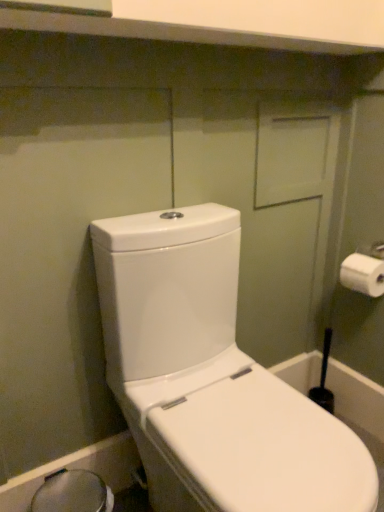
Question: Is white matte toilet paper at right turned away from transparent plastic bidet at lower left?

Choices:
 (A) no
 (B) yes

Answer: (A)

Question: Considering the relative positions of white matte toilet paper at right and transparent plastic bidet at lower left in the image provided, is white matte toilet paper at right in front of transparent plastic bidet at lower left?

Choices:
 (A) yes
 (B) no

Answer: (B)

Question: Are white matte toilet paper at right and transparent plastic bidet at lower left far apart?

Choices:
 (A) no
 (B) yes

Answer: (B)

Question: Does white matte toilet paper at right have a smaller size compared to transparent plastic bidet at lower left?

Choices:
 (A) yes
 (B) no

Answer: (A)

Question: From a real-world perspective, is white matte toilet paper at right beneath transparent plastic bidet at lower left?

Choices:
 (A) yes
 (B) no

Answer: (B)

Question: Based on their sizes in the image, would you say white matte toilet paper at right is bigger or smaller than white glossy toilet at left?

Choices:
 (A) big
 (B) small

Answer: (B)

Question: Would you say white matte toilet paper at right is to the left or to the right of white glossy toilet at left in the picture?

Choices:
 (A) right
 (B) left

Answer: (A)

Question: In terms of width, does white matte toilet paper at right look wider or thinner when compared to white glossy toilet at left?

Choices:
 (A) thin
 (B) wide

Answer: (A)

Question: From a real-world perspective, is white matte toilet paper at right above or below white glossy toilet at left?

Choices:
 (A) above
 (B) below

Answer: (A)

Question: Relative to transparent plastic bidet at lower left, is white matte toilet paper at right in front or behind?

Choices:
 (A) behind
 (B) front

Answer: (A)

Question: Visually, is white matte toilet paper at right positioned to the left or to the right of transparent plastic bidet at lower left?

Choices:
 (A) left
 (B) right

Answer: (B)

Question: In terms of width, does white matte toilet paper at right look wider or thinner when compared to transparent plastic bidet at lower left?

Choices:
 (A) thin
 (B) wide

Answer: (A)

Question: Is point (367, 264) closer or farther from the camera than point (41, 494)?

Choices:
 (A) farther
 (B) closer

Answer: (A)

Question: Based on their sizes in the image, would you say transparent plastic bidet at lower left is bigger or smaller than white glossy toilet at left?

Choices:
 (A) small
 (B) big

Answer: (A)

Question: Is transparent plastic bidet at lower left taller or shorter than white glossy toilet at left?

Choices:
 (A) tall
 (B) short

Answer: (B)